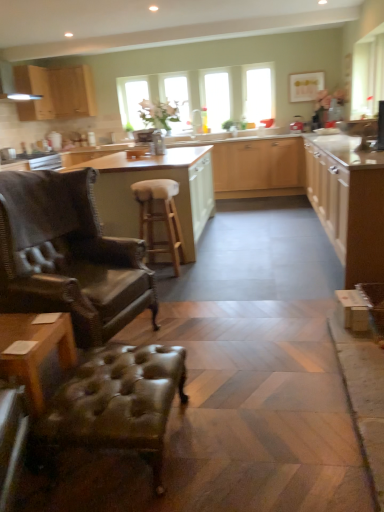
Question: From a real-world perspective, is clear glass window at center, the 2th window screen positioned from the right, under matte wood cabinetry at center, which ranks as the 3th cabinetry in left-to-right order?

Choices:
 (A) yes
 (B) no

Answer: (B)

Question: Would you say clear glass window at center, positioned as the 1th window screen in left-to-right order, is a long distance from matte wood cabinetry at center, which ranks as the 3th cabinetry in left-to-right order?

Choices:
 (A) yes
 (B) no

Answer: (A)

Question: Is clear glass window at center, positioned as the 1th window screen in left-to-right order, shorter than matte wood cabinetry at center, which ranks as the 3th cabinetry in left-to-right order?

Choices:
 (A) no
 (B) yes

Answer: (A)

Question: Does clear glass window at center, positioned as the 1th window screen in left-to-right order, have a smaller size compared to matte wood cabinetry at center, which is the second cabinetry from right to left?

Choices:
 (A) yes
 (B) no

Answer: (A)

Question: Is clear glass window at center, the 2th window screen positioned from the right, looking in the opposite direction of matte wood cabinetry at center, which ranks as the 3th cabinetry in left-to-right order?

Choices:
 (A) no
 (B) yes

Answer: (A)

Question: From the image's perspective, is transparent glass window at center, the first window screen viewed from the right, located above or below leather tufted ottoman at lower left?

Choices:
 (A) above
 (B) below

Answer: (A)

Question: Considering the positions of transparent glass window at center, which is the 2th window screen in left-to-right order, and leather tufted ottoman at lower left in the image, is transparent glass window at center, which is the 2th window screen in left-to-right order, taller or shorter than leather tufted ottoman at lower left?

Choices:
 (A) short
 (B) tall

Answer: (B)

Question: Considering the positions of transparent glass window at center, the first window screen viewed from the right, and leather tufted ottoman at lower left in the image, is transparent glass window at center, the first window screen viewed from the right, wider or thinner than leather tufted ottoman at lower left?

Choices:
 (A) thin
 (B) wide

Answer: (A)

Question: From a real-world perspective, relative to leather tufted ottoman at lower left, is transparent glass window at center, which is the 2th window screen in left-to-right order, vertically above or below?

Choices:
 (A) below
 (B) above

Answer: (B)

Question: Would you say clear glass window at center, positioned as the 1th window screen in left-to-right order, is inside or outside white wood bar stool at center, which is the 2th cabinetry from left to right?

Choices:
 (A) outside
 (B) inside

Answer: (A)

Question: From a real-world perspective, is clear glass window at center, positioned as the 1th window screen in left-to-right order, above or below white wood bar stool at center, which is the 2th cabinetry from left to right?

Choices:
 (A) above
 (B) below

Answer: (A)

Question: From the image's perspective, is clear glass window at center, the 2th window screen positioned from the right, above or below white wood bar stool at center, which is the 2th cabinetry from left to right?

Choices:
 (A) above
 (B) below

Answer: (A)

Question: In terms of height, does clear glass window at center, the 2th window screen positioned from the right, look taller or shorter compared to white wood bar stool at center, which is counted as the third cabinetry, starting from the right?

Choices:
 (A) tall
 (B) short

Answer: (B)

Question: From the image's perspective, is matte wood cabinet at right, the first cabinetry when ordered from right to left, positioned above or below wooden stool at center?

Choices:
 (A) below
 (B) above

Answer: (B)

Question: Considering the positions of matte wood cabinet at right, positioned as the fourth cabinetry in left-to-right order, and wooden stool at center in the image, is matte wood cabinet at right, positioned as the fourth cabinetry in left-to-right order, taller or shorter than wooden stool at center?

Choices:
 (A) tall
 (B) short

Answer: (A)